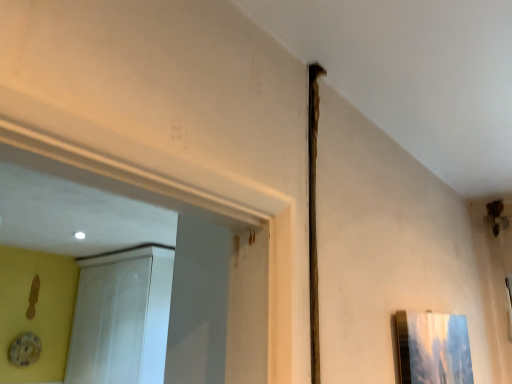
Question: Should I look upward or downward to see white glossy screen door at upper left?

Choices:
 (A) down
 (B) up

Answer: (A)